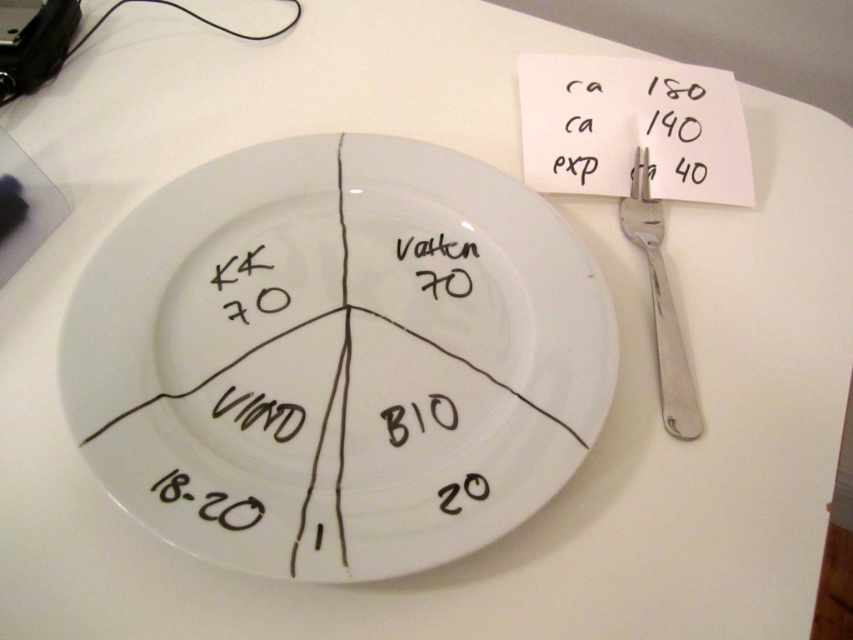
Does white paper at upper right appear under white matte text at center?

No, white paper at upper right is not below white matte text at center.

In the scene shown: Does white paper at upper right have a smaller size compared to white matte text at center?

Incorrect, white paper at upper right is not smaller in size than white matte text at center.

This screenshot has height=640, width=853. Identify the location of white paper at upper right. (631, 128).

Between white ceramic plate at center and white matte text at center, which one has less height?

white matte text at center

Does point (602, 321) come in front of point (434, 278)?

Yes, it is in front of point (434, 278).

Between point (518, 412) and point (440, 252), which one is positioned in front?

Point (518, 412) is more forward.

Find the location of a particular element. The height and width of the screenshot is (640, 853). white ceramic plate at center is located at coordinates (335, 358).

Can you confirm if white ceramic plate at center is bigger than white paper at upper right?

Indeed, white ceramic plate at center has a larger size compared to white paper at upper right.

Does white ceramic plate at center appear under white paper at upper right?

Yes, white ceramic plate at center is below white paper at upper right.

At what (x,y) coordinates should I click in order to perform the action: click on white ceramic plate at center. Please return your answer as a coordinate pair (x, y). The width and height of the screenshot is (853, 640). Looking at the image, I should click on (335, 358).